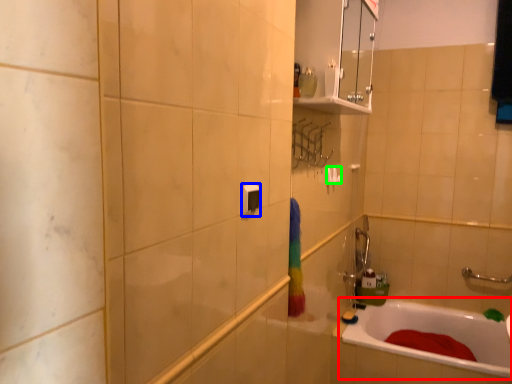
Question: Which object is the closest to the bathtub (highlighted by a red box)? Choose among these: light switch (highlighted by a blue box) or towel bar (highlighted by a green box).

Choices:
 (A) light switch
 (B) towel bar

Answer: (B)